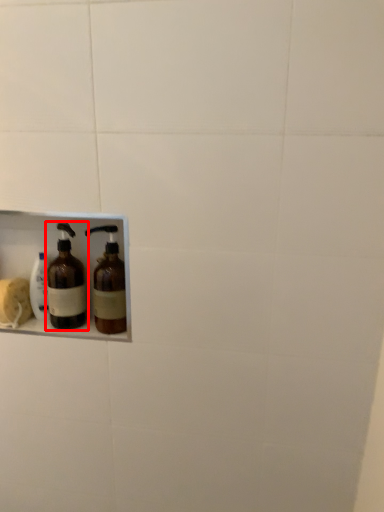
Question: From the image's perspective, what is the correct spatial positioning of bottle (annotated by the red box) in reference to bottle?

Choices:
 (A) above
 (B) below

Answer: (A)